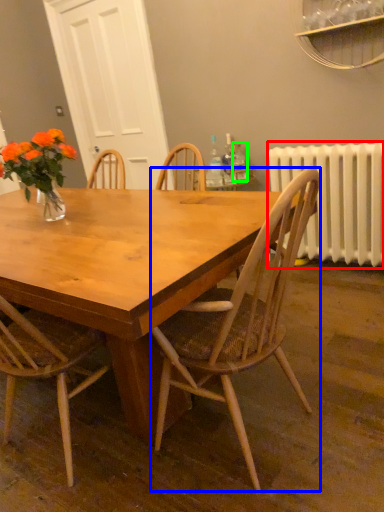
Question: Which object is positioned closest to radiator (highlighted by a red box)? Select from chair (highlighted by a blue box) and bottle (highlighted by a green box).

Choices:
 (A) chair
 (B) bottle

Answer: (B)